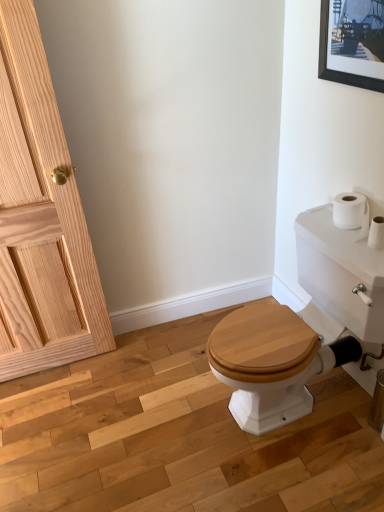
Locate an element on the screen. spots to the right of natural wood door at left is located at coordinates (125, 374).